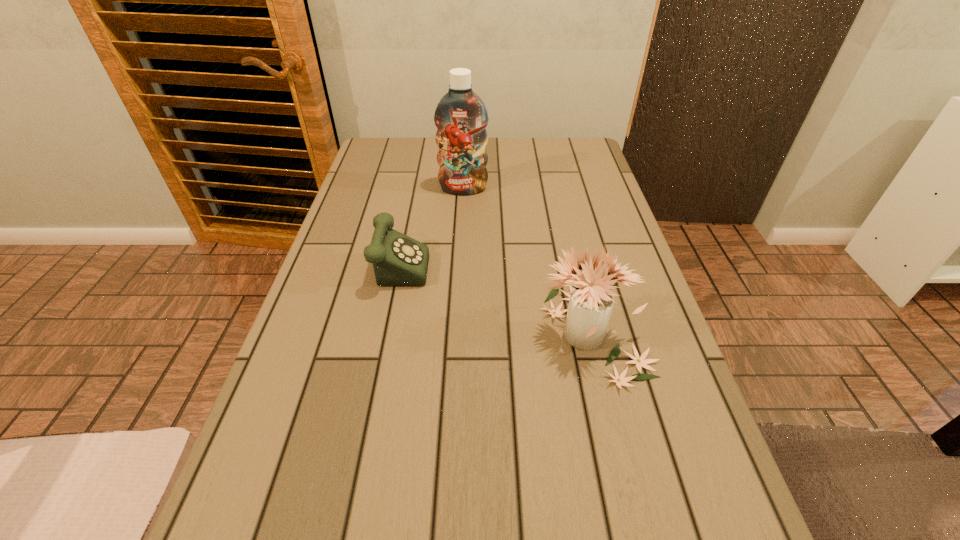
The height and width of the screenshot is (540, 960). What are the coordinates of `vacant space that satisfies the following two spatial constraints: 1. on the front label of the tallest object; 2. on the dial of the telephone` in the screenshot? It's located at (460, 260).

The height and width of the screenshot is (540, 960). Identify the location of free spot that satisfies the following two spatial constraints: 1. on the front label of the shampoo; 2. on the left side of the rightmost object. (456, 334).